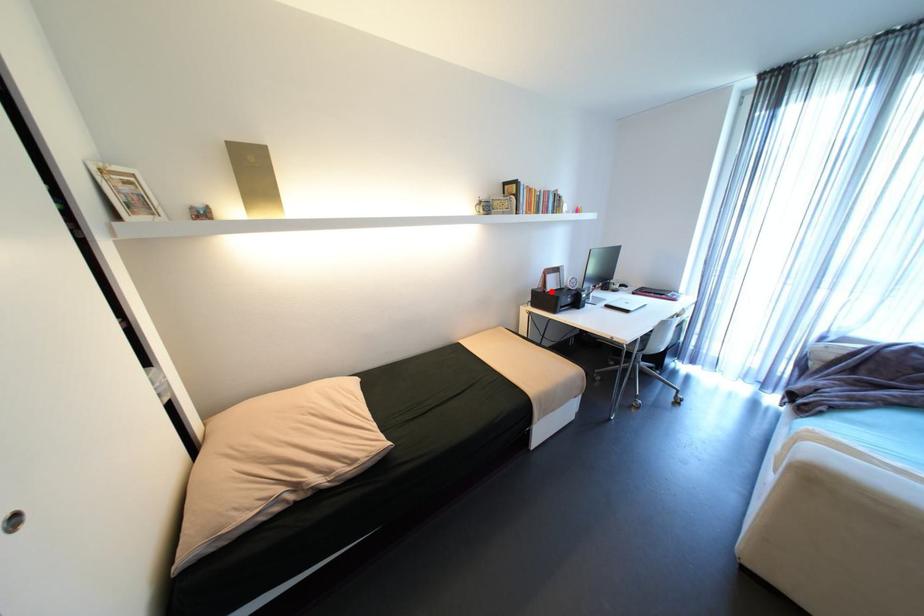
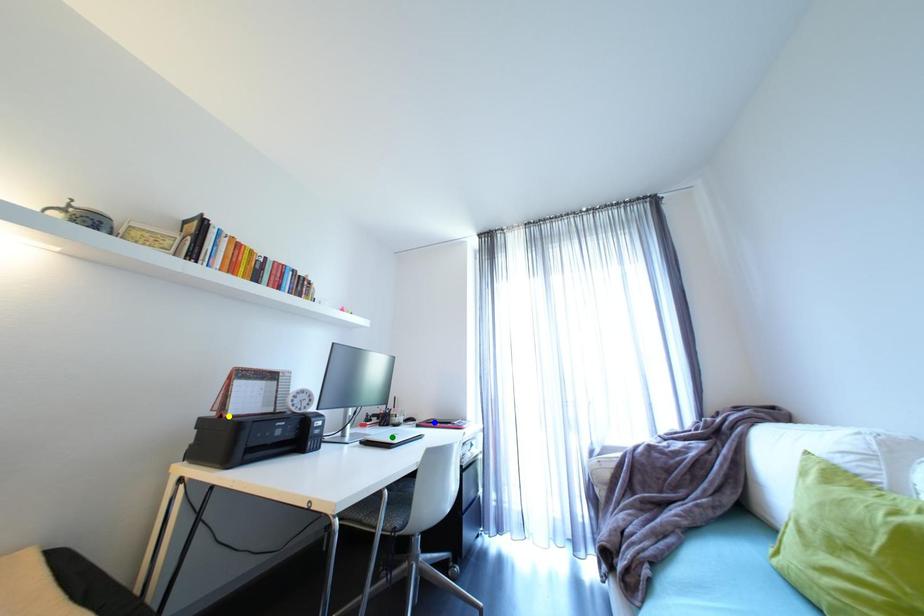
Question: I am providing you with two images of the same scene from different viewpoints. A red point is marked on the first image. You are given multiple points on the second image. Which point in image 2 represents the same 3d spot as the red point in image 1?

Choices:
 (A) blue point
 (B) yellow point
 (C) green point

Answer: (B)